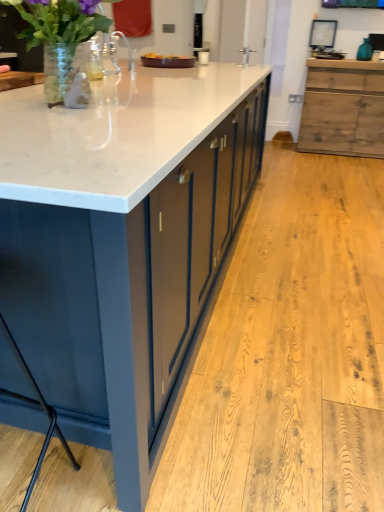
Question: From a real-world perspective, is white marble countertop at center below clear glass vase at upper left?

Choices:
 (A) no
 (B) yes

Answer: (B)

Question: Is clear glass vase at upper left at the back of white marble countertop at center?

Choices:
 (A) no
 (B) yes

Answer: (A)

Question: Is white marble countertop at center not near clear glass vase at upper left?

Choices:
 (A) no
 (B) yes

Answer: (A)

Question: Is the depth of white marble countertop at center greater than that of clear glass vase at upper left?

Choices:
 (A) yes
 (B) no

Answer: (B)

Question: Is white marble countertop at center closer to the viewer compared to clear glass vase at upper left?

Choices:
 (A) yes
 (B) no

Answer: (A)

Question: Considering the positions of white marble countertop at center and rustic wood cabinet at right in the image, is white marble countertop at center bigger or smaller than rustic wood cabinet at right?

Choices:
 (A) small
 (B) big

Answer: (B)

Question: From a real-world perspective, relative to rustic wood cabinet at right, is white marble countertop at center vertically above or below?

Choices:
 (A) above
 (B) below

Answer: (A)

Question: Is point (163, 287) positioned closer to the camera than point (311, 138)?

Choices:
 (A) closer
 (B) farther

Answer: (A)

Question: In terms of height, does white marble countertop at center look taller or shorter compared to rustic wood cabinet at right?

Choices:
 (A) short
 (B) tall

Answer: (B)

Question: From their relative heights in the image, would you say clear glass vase at upper left is taller or shorter than white marble countertop at center?

Choices:
 (A) short
 (B) tall

Answer: (A)

Question: Looking at their shapes, would you say clear glass vase at upper left is wider or thinner than white marble countertop at center?

Choices:
 (A) wide
 (B) thin

Answer: (B)

Question: From the image's perspective, is clear glass vase at upper left located above or below white marble countertop at center?

Choices:
 (A) above
 (B) below

Answer: (A)

Question: Based on their sizes in the image, would you say clear glass vase at upper left is bigger or smaller than white marble countertop at center?

Choices:
 (A) small
 (B) big

Answer: (A)

Question: Is matte dark blue bar stool at lower left to the left or to the right of rustic wood cabinet at right in the image?

Choices:
 (A) left
 (B) right

Answer: (A)

Question: From the image's perspective, relative to rustic wood cabinet at right, is matte dark blue bar stool at lower left above or below?

Choices:
 (A) below
 (B) above

Answer: (A)